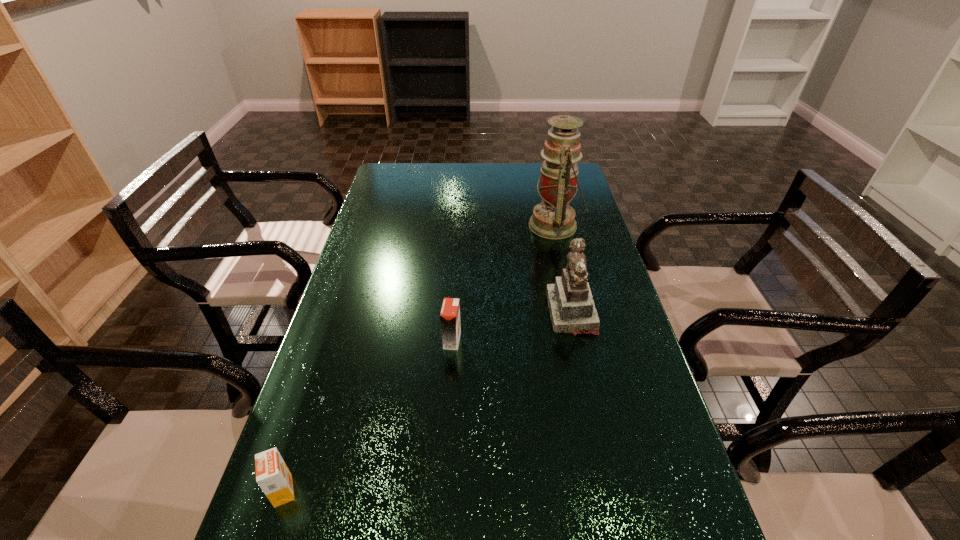
Identify the location of vacant area located on the front-facing side of the figurine. (437, 313).

I want to click on free space located on the right of the right orange juice, so click(x=607, y=341).

You are a GUI agent. You are given a task and a screenshot of the screen. Output one action in this format:
    pyautogui.click(x=<x>, y=<y>)
    Task: Click on the vacant space located 0.150m on the right of the leftmost object
    This screenshot has width=960, height=540.
    Given the screenshot: What is the action you would take?
    pyautogui.click(x=372, y=491)

Identify the location of object that is at the left edge. The image size is (960, 540). (272, 475).

In order to click on oil lamp at the right edge in this screenshot , I will do `click(553, 218)`.

This screenshot has height=540, width=960. I want to click on figurine located in the right edge section of the desktop, so pos(572,310).

This screenshot has height=540, width=960. Identify the location of free space at the far edge. (453, 174).

Locate an element on the screen. The image size is (960, 540). vacant space at the left edge of the desktop is located at coordinates (323, 356).

At what (x,y) coordinates should I click in order to perform the action: click on vacant region at the right edge of the desktop. Please return your answer as a coordinate pair (x, y). Looking at the image, I should click on point(609,450).

Image resolution: width=960 pixels, height=540 pixels. I want to click on vacant space that's between the nearest object and the second object from left to right, so click(x=368, y=416).